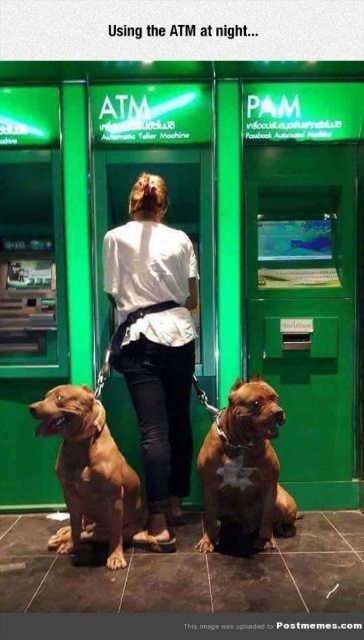
Does brown shiny fur at lower center appear over brown leather dog at center?

Actually, brown shiny fur at lower center is below brown leather dog at center.

What do you see at coordinates (89, 474) in the screenshot?
I see `brown shiny fur at lower center` at bounding box center [89, 474].

Locate an element on the screen. brown shiny fur at lower center is located at coordinates (89, 474).

Measure the distance from white matte shirt at center to brown leather dog at center.

A distance of 17.57 inches exists between white matte shirt at center and brown leather dog at center.

Who is more distant from viewer, (x=152, y=406) or (x=239, y=490)?

Positioned behind is point (x=152, y=406).

Where is `white matte shirt at center`? white matte shirt at center is located at coordinates (155, 344).

Where is `white matte shirt at center`? white matte shirt at center is located at coordinates (155, 344).

Can you confirm if white matte shirt at center is thinner than brown shiny fur at lower center?

Incorrect, white matte shirt at center's width is not less than brown shiny fur at lower center's.

At what (x,y) coordinates should I click in order to perform the action: click on white matte shirt at center. Please return your answer as a coordinate pair (x, y). The width and height of the screenshot is (364, 640). Looking at the image, I should click on (155, 344).

Which is behind, point (112, 353) or point (124, 538)?

Point (112, 353)

You are a GUI agent. You are given a task and a screenshot of the screen. Output one action in this format:
    pyautogui.click(x=<x>, y=<y>)
    Task: Click on the white matte shirt at center
    Image resolution: width=364 pixels, height=640 pixels.
    Given the screenshot: What is the action you would take?
    click(155, 344)